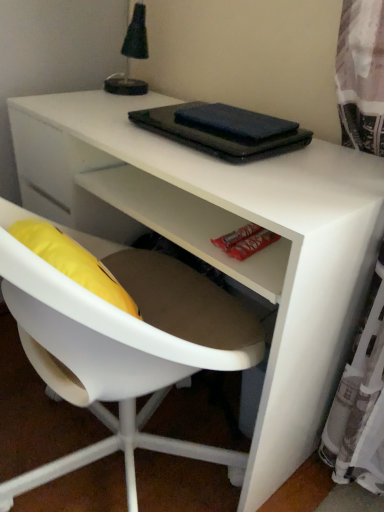
This screenshot has width=384, height=512. Find the location of `free spot in front of black matte notebook at center, the 2th notebook positioned from the top`. free spot in front of black matte notebook at center, the 2th notebook positioned from the top is located at coordinates (244, 174).